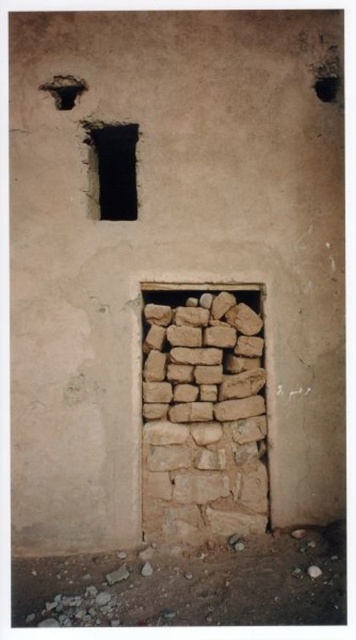
Is black stone window at upper center thinner than smooth dark hole at upper right?

No, black stone window at upper center is not thinner than smooth dark hole at upper right.

Looking at this image, between black stone window at upper center and smooth dark hole at upper right, which one appears on the left side from the viewer's perspective?

Positioned to the left is black stone window at upper center.

Between point (107, 125) and point (330, 93), which one is positioned in front?

Point (107, 125) is in front.

Where is `black stone window at upper center`? The width and height of the screenshot is (356, 640). black stone window at upper center is located at coordinates (113, 168).